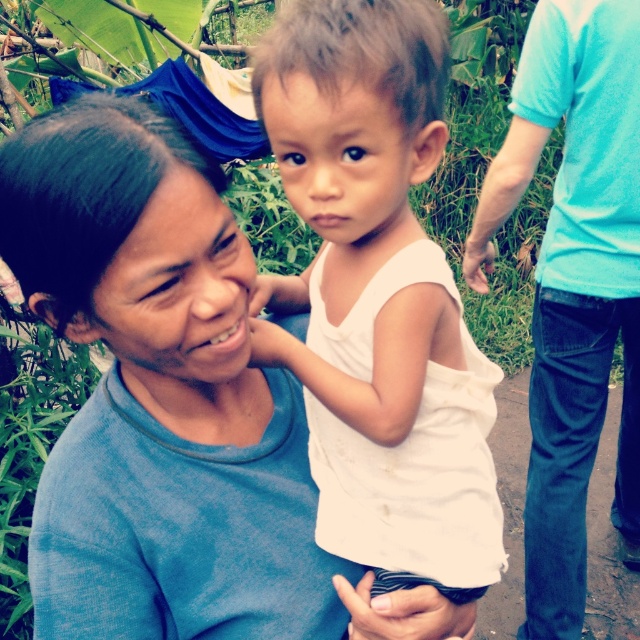
Question: Which of the following is the closest to the observer?

Choices:
 (A) white cotton shirt at center
 (B) light blue t-shirt at right

Answer: (A)

Question: Is white cotton shirt at center to the right of light blue t-shirt at right from the viewer's perspective?

Choices:
 (A) yes
 (B) no

Answer: (B)

Question: Does white cotton shirt at center appear under light blue t-shirt at right?

Choices:
 (A) no
 (B) yes

Answer: (A)

Question: Which point appears closest to the camera in this image?

Choices:
 (A) (404, 148)
 (B) (557, 221)

Answer: (A)

Question: Can you confirm if white cotton shirt at center is smaller than light blue t-shirt at right?

Choices:
 (A) no
 (B) yes

Answer: (B)